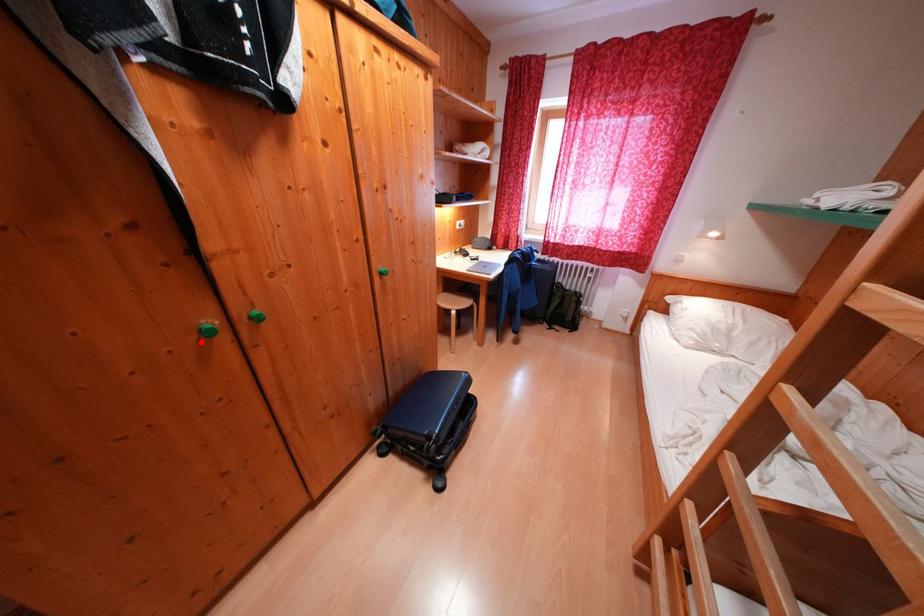
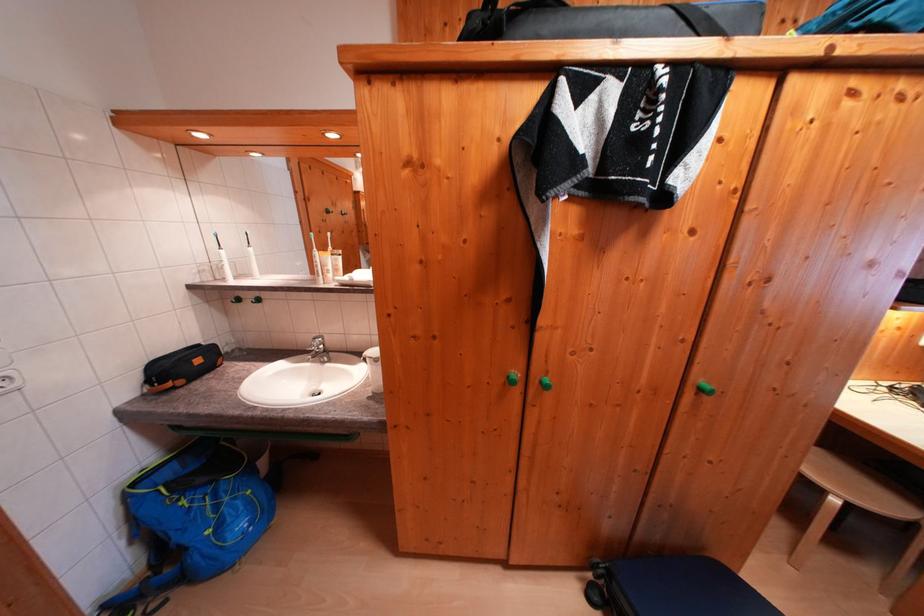
Where in the second image is the point corresponding to the highlighted location from the first image?

(511, 384)